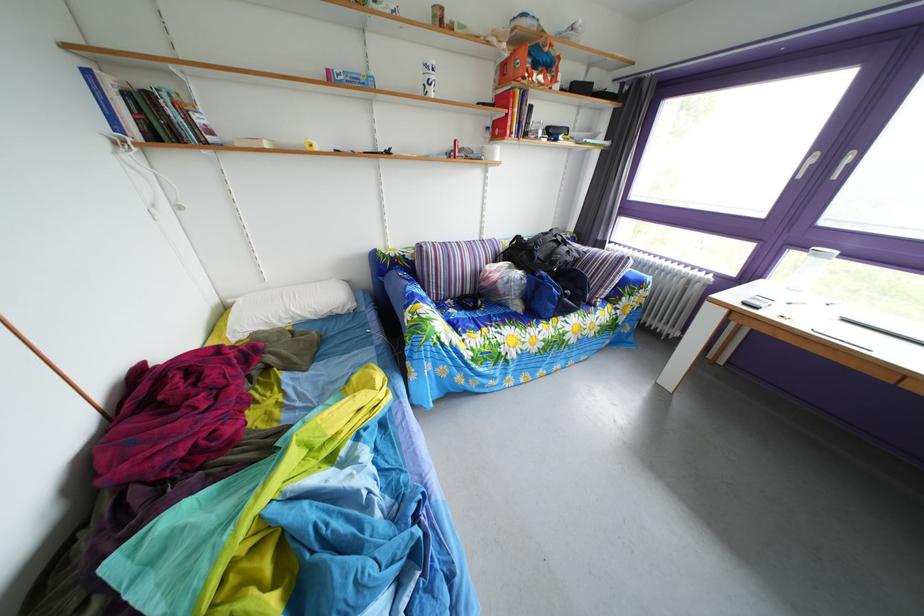
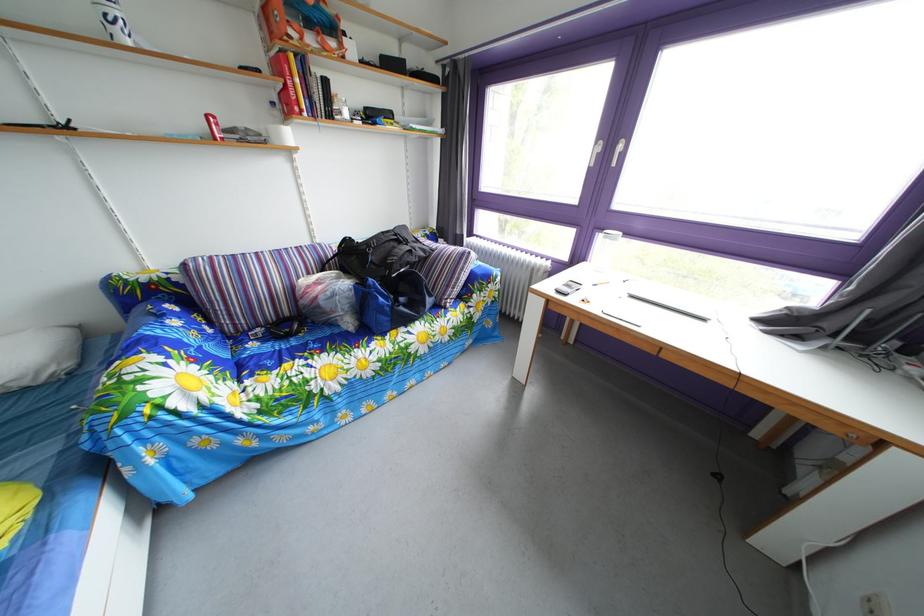
In the second image, find the point that corresponds to point (772, 285) in the first image.

(594, 268)